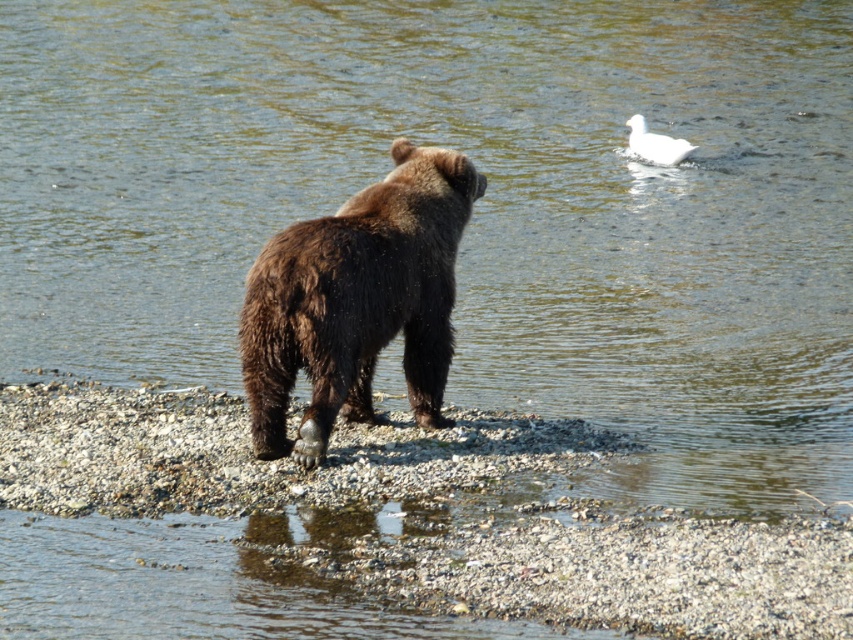
You are a wildlife photographer aiming to capture a photo of the brown furry bear at center and the white matte duck at upper right in the same frame. Based on their positions, which animal is closer to the camera?

The brown furry bear at center is closer to the camera because it is positioned at the center of the scene facing away, while the white matte duck at upper right is further away near the water.

You are a photographer trying to capture the brown furry bear at center and the smooth gravel shore at center in a single shot. Based on their sizes, which one should you focus on to ensure both are clearly visible in the frame?

The smooth gravel shore at center is larger in size than the brown furry bear at center, so focusing on the shore will ensure both are visible as the bear will fit within the frame alongside the larger shore area.